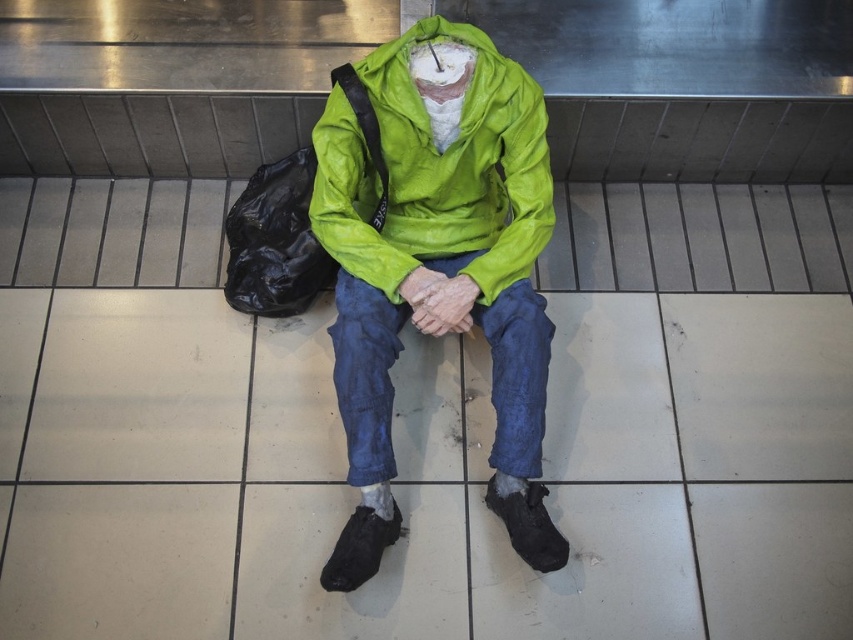
In the scene shown: You are a delivery person who needs to place a small package between the green tarpaulin jacket at center and the denim at center. Can you fit it there?

The distance between the green tarpaulin jacket at center and the denim at center is 7.03 inches, so yes, the package can be placed there as the space is sufficient.

You are an observer in the scene. You see a figure wearing two jackets at the center. Which jacket is closer to you, the matte green jacket at center or the green tarpaulin jacket at center?

The matte green jacket at center is closer to you because it is in front of the green tarpaulin jacket at center.

You are an artist who wants to paint the two jackets in the scene. Since you have limited space on your canvas, you need to know if the distance between the matte green jacket at center and the green tarpaulin jacket at center is less than 2 inches. Can you confirm?

The matte green jacket at center is 1.80 inches from green tarpaulin jacket at center, so yes, the distance between them is less than 2 inches.